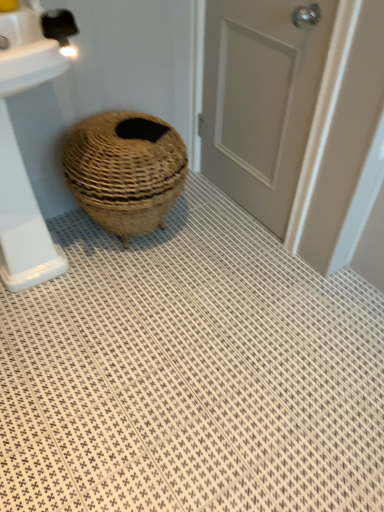
At what (x,y) coordinates should I click in order to perform the action: click on natural woven basket at center. Please return your answer as a coordinate pair (x, y). Looking at the image, I should click on (125, 170).

What is the approximate height of natural woven basket at center?

The height of natural woven basket at center is 17.99 inches.

Find the location of a particular element. The height and width of the screenshot is (512, 384). white glossy sink at left is located at coordinates (22, 159).

This screenshot has width=384, height=512. What do you see at coordinates (191, 374) in the screenshot?
I see `white textured bath mat at center` at bounding box center [191, 374].

Where is `natural woven basket at center`? The height and width of the screenshot is (512, 384). natural woven basket at center is located at coordinates (125, 170).

Between white glossy sink at left and matte gray door at center, which one has larger size?

Bigger between the two is white glossy sink at left.

Who is taller, white glossy sink at left or matte gray door at center?

With more height is matte gray door at center.

Find the location of a particular element. Image resolution: width=384 pixels, height=512 pixels. door above the white glossy sink at left (from the image's perspective) is located at coordinates (x=261, y=99).

From a real-world perspective, who is located higher, white glossy sink at left or matte gray door at center?

From a 3D spatial view, matte gray door at center is above.

Is white glossy sink at left placed right next to white textured bath mat at center?

No, white glossy sink at left is not touching white textured bath mat at center.

Does point (12, 187) appear closer or farther from the camera than point (187, 227)?

Clearly, point (12, 187) is closer to the camera than point (187, 227).

Considering the relative sizes of white glossy sink at left and white textured bath mat at center in the image provided, is white glossy sink at left thinner than white textured bath mat at center?

Correct, the width of white glossy sink at left is less than that of white textured bath mat at center.

Which of these two, white glossy sink at left or white textured bath mat at center, is smaller?

Smaller between the two is white textured bath mat at center.

How different are the orientations of natural woven basket at center and white textured bath mat at center in degrees?

180 degrees separate the facing orientations of natural woven basket at center and white textured bath mat at center.

In the scene shown: From a real-world perspective, is natural woven basket at center above or below white textured bath mat at center?

In terms of real-world spatial position, natural woven basket at center is above white textured bath mat at center.

In order to click on basket above the white textured bath mat at center (from a real-world perspective) in this screenshot , I will do `click(125, 170)`.

Is natural woven basket at center not inside white textured bath mat at center?

That's correct, natural woven basket at center is outside of white textured bath mat at center.

The image size is (384, 512). Find the location of `sink below the matte gray door at center (from a real-world perspective)`. sink below the matte gray door at center (from a real-world perspective) is located at coordinates click(22, 159).

Based on their sizes in the image, would you say matte gray door at center is bigger or smaller than white glossy sink at left?

matte gray door at center is smaller than white glossy sink at left.

From a real-world perspective, is matte gray door at center on white glossy sink at left?

Yes, from a real-world perspective, matte gray door at center is over white glossy sink at left

Considering the positions of objects matte gray door at center and white glossy sink at left in the image provided, who is behind, matte gray door at center or white glossy sink at left?

matte gray door at center is further away from the camera.

Would you say natural woven basket at center is inside or outside matte gray door at center?

natural woven basket at center cannot be found inside matte gray door at center.

In the scene shown: Looking at the image, does natural woven basket at center seem bigger or smaller compared to matte gray door at center?

Clearly, natural woven basket at center is larger in size than matte gray door at center.

How different are the orientations of natural woven basket at center and matte gray door at center in degrees?

91.7 degrees.

Does natural woven basket at center turn towards matte gray door at center?

No, natural woven basket at center is not facing towards matte gray door at center.

Considering the positions of objects white textured bath mat at center and white glossy sink at left in the image provided, who is more to the left, white textured bath mat at center or white glossy sink at left?

white glossy sink at left is more to the left.

In the image, is white textured bath mat at center positioned in front of or behind white glossy sink at left?

Clearly, white textured bath mat at center is in front of white glossy sink at left.

Who is taller, white textured bath mat at center or white glossy sink at left?

white glossy sink at left is taller.

Is matte gray door at center not inside natural woven basket at center?

Absolutely, matte gray door at center is external to natural woven basket at center.

Is matte gray door at center not near natural woven basket at center?

That's not correct — matte gray door at center is a little close to natural woven basket at center.

In order to click on sink in front of the matte gray door at center in this screenshot , I will do `click(22, 159)`.

Locate an element on the screen. bath mat that appears below the white glossy sink at left (from the image's perspective) is located at coordinates (191, 374).

Which object lies nearer to the anchor point white glossy sink at left, white textured bath mat at center or natural woven basket at center?

natural woven basket at center lies closer to white glossy sink at left than the other object.

When comparing their distances from white textured bath mat at center, does natural woven basket at center or white glossy sink at left seem further?

Based on the image, white glossy sink at left appears to be further to white textured bath mat at center.

From the image, which object appears to be farther from white textured bath mat at center, white glossy sink at left or matte gray door at center?

Based on the image, matte gray door at center appears to be further to white textured bath mat at center.

Which object lies nearer to the anchor point white textured bath mat at center, natural woven basket at center or matte gray door at center?

natural woven basket at center.

Estimate the real-world distances between objects in this image. Which object is further from matte gray door at center, natural woven basket at center or white textured bath mat at center?

white textured bath mat at center.

Which object lies further to the anchor point white glossy sink at left, matte gray door at center or natural woven basket at center?

Among the two, matte gray door at center is located further to white glossy sink at left.

From the image, which object appears to be nearer to matte gray door at center, white glossy sink at left or white textured bath mat at center?

white textured bath mat at center.

Considering their positions, is matte gray door at center positioned further to white glossy sink at left than white textured bath mat at center?

matte gray door at center lies further to white glossy sink at left than the other object.

At what (x,y) coordinates should I click in order to perform the action: click on sink between white textured bath mat at center and natural woven basket at center along the z-axis. Please return your answer as a coordinate pair (x, y). Looking at the image, I should click on (22, 159).

Identify the location of basket between matte gray door at center and white textured bath mat at center in the vertical direction. The width and height of the screenshot is (384, 512). (125, 170).

The image size is (384, 512). What are the coordinates of `bath mat between white glossy sink at left and matte gray door at center in the horizontal direction` in the screenshot? It's located at (191, 374).

Where is `basket situated between white glossy sink at left and matte gray door at center from left to right`? basket situated between white glossy sink at left and matte gray door at center from left to right is located at coordinates (125, 170).